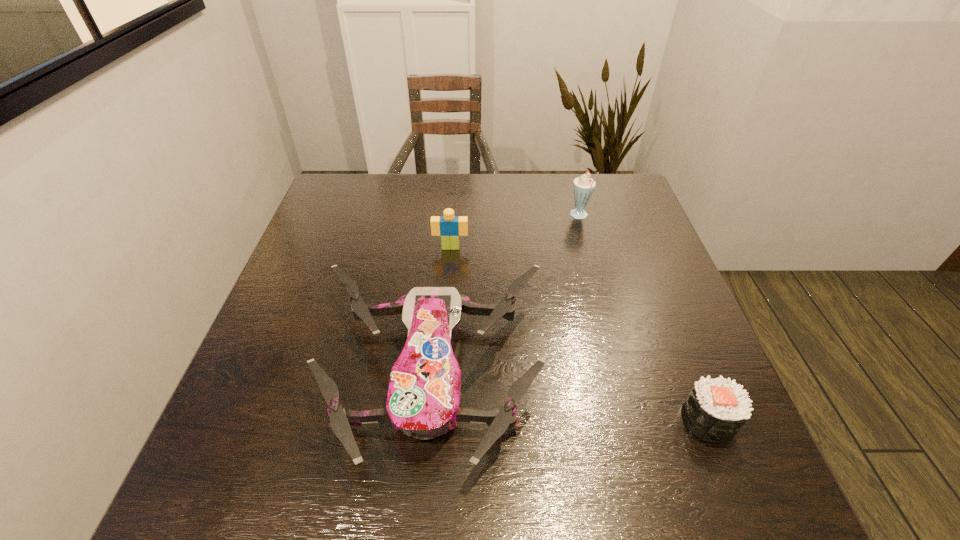
Identify the location of vacant region at the left edge of the desktop. (249, 393).

Identify the location of free region at the right edge of the desktop. (617, 223).

Where is `free spot at the near right corner of the desktop`? free spot at the near right corner of the desktop is located at coordinates (679, 483).

At what (x,y) coordinates should I click in order to perform the action: click on vacant area that lies between the drone and the sushi. Please return your answer as a coordinate pair (x, y). Looking at the image, I should click on (569, 397).

Where is `free spot between the Lego and the tallest object`? free spot between the Lego and the tallest object is located at coordinates (516, 232).

The height and width of the screenshot is (540, 960). Identify the location of vacant area between the drone and the shortest object. (569, 397).

Identify the location of free space between the third object from left to right and the sushi. This screenshot has width=960, height=540. (x=643, y=319).

The image size is (960, 540). What are the coordinates of `vacant area that lies between the second farthest object and the shortest object` in the screenshot? It's located at (579, 334).

Where is `free space between the third nearest object and the second object from right to left`? The width and height of the screenshot is (960, 540). free space between the third nearest object and the second object from right to left is located at coordinates pos(516,232).

Point out which object is positioned as the second nearest to the milkshake. Please provide its 2D coordinates. Your answer should be formatted as a tuple, i.e. [(x, y)], where the tuple contains the x and y coordinates of a point satisfying the conditions above.

[(423, 399)]